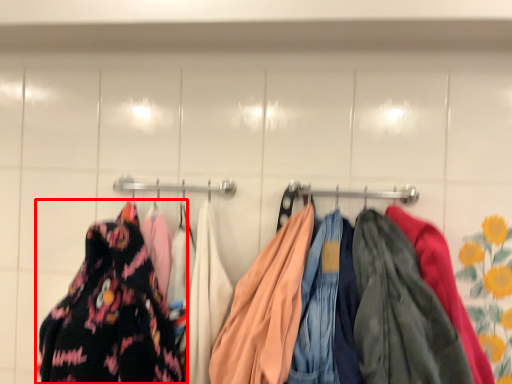
Question: From the image's perspective, where is fancy dress (annotated by the red box) located in relation to laundry in the image?

Choices:
 (A) above
 (B) below

Answer: (A)